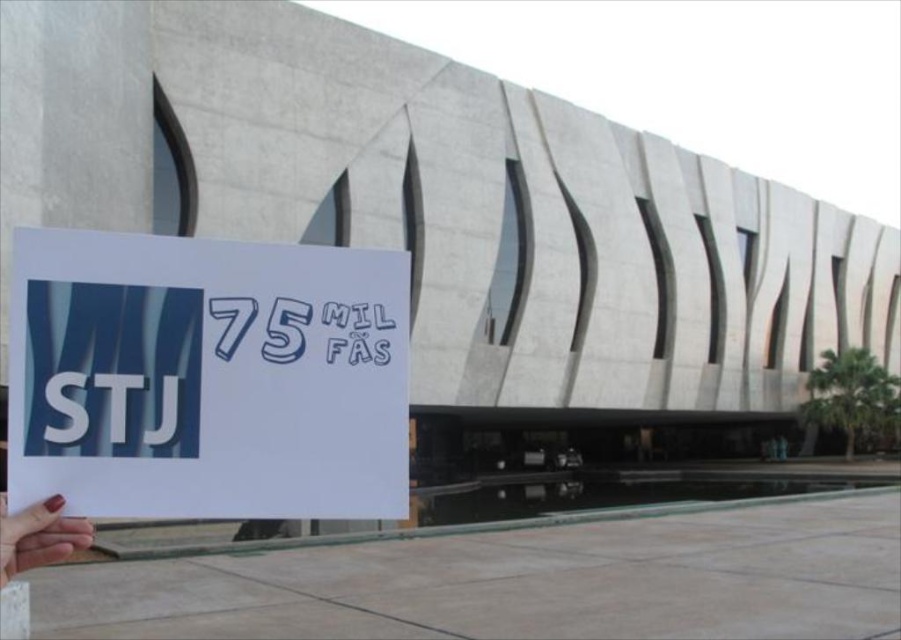
Question: From the image, what is the correct spatial relationship of white paper at center in relation to smooth skin hand at lower left?

Choices:
 (A) above
 (B) below

Answer: (A)

Question: Which point is closer to the camera?

Choices:
 (A) white paper at center
 (B) smooth skin hand at lower left

Answer: (B)

Question: Is white paper at center below smooth skin hand at lower left?

Choices:
 (A) yes
 (B) no

Answer: (B)

Question: Does white paper at center have a greater width compared to smooth skin hand at lower left?

Choices:
 (A) no
 (B) yes

Answer: (B)

Question: Which point is farther to the camera?

Choices:
 (A) white paper at center
 (B) smooth skin hand at lower left

Answer: (A)